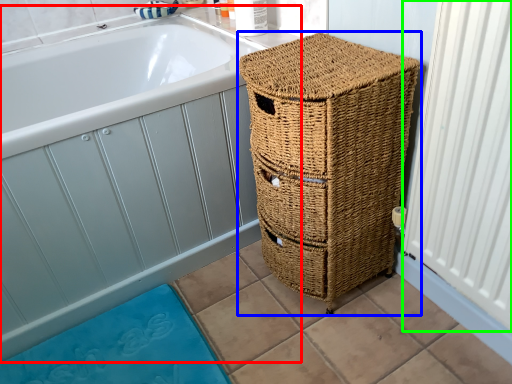
Question: Considering the real-world distances, which object is closest to bath (highlighted by a red box)? furniture (highlighted by a blue box) or radiator (highlighted by a green box).

Choices:
 (A) furniture
 (B) radiator

Answer: (A)